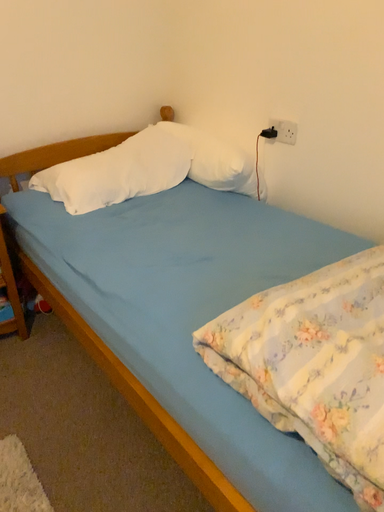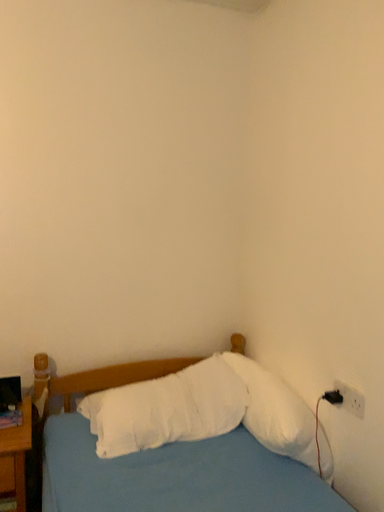
Question: Which way did the camera rotate in the video?

Choices:
 (A) rotated right
 (B) rotated left

Answer: (B)